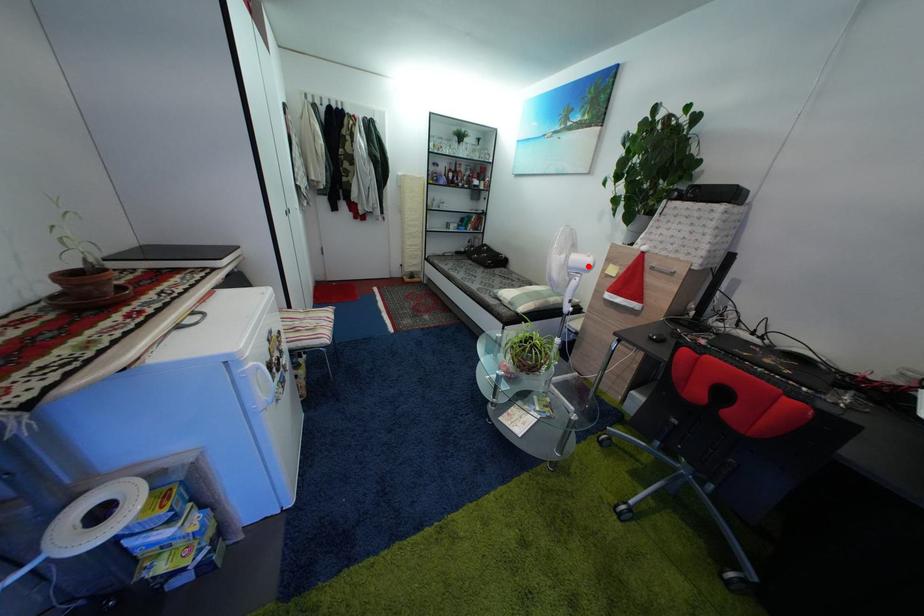
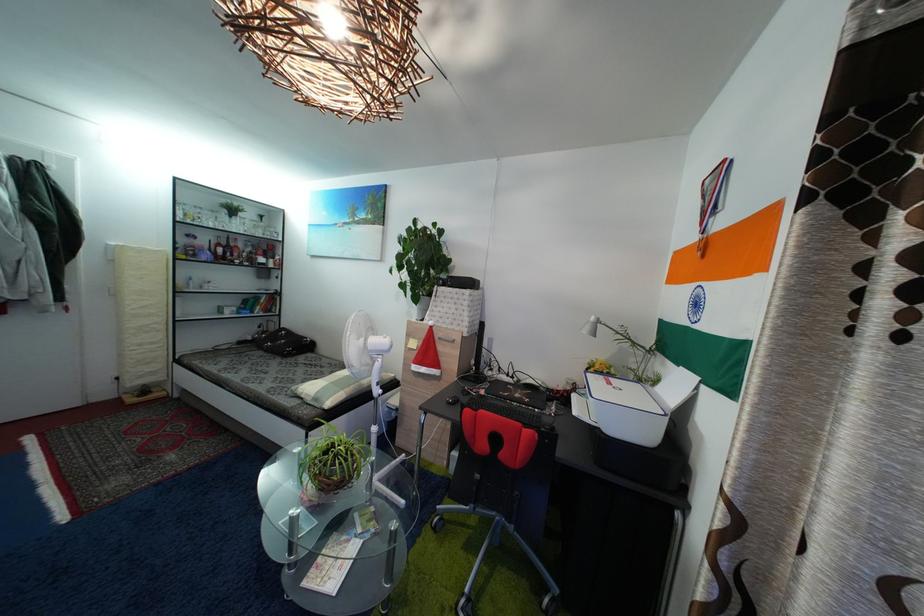
In the second image, find the point that corresponds to the highlighted location in the first image.

(386, 349)